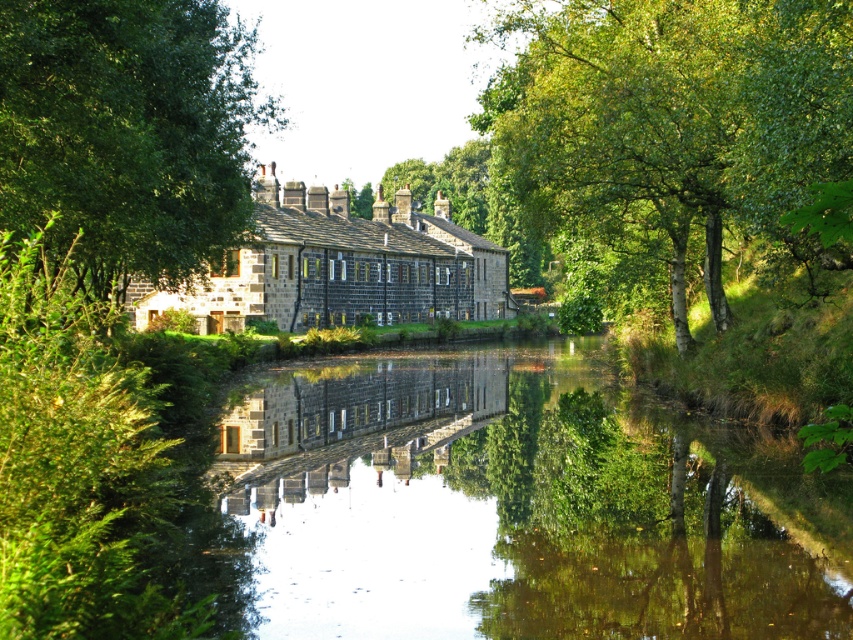
Question: Which point is farther from the camera taking this photo?

Choices:
 (A) (624, 19)
 (B) (189, 232)
 (C) (520, 634)

Answer: (A)

Question: Where is green leafy tree at upper center located in relation to green leafy tree at upper left in the image?

Choices:
 (A) left
 (B) right

Answer: (B)

Question: Can you confirm if smooth reflective water at center is positioned above green leafy tree at upper left?

Choices:
 (A) no
 (B) yes

Answer: (A)

Question: Is the position of smooth reflective water at center more distant than that of green leafy tree at upper left?

Choices:
 (A) yes
 (B) no

Answer: (B)

Question: Estimate the real-world distances between objects in this image. Which object is closer to the green leafy tree at upper left?

Choices:
 (A) smooth reflective water at center
 (B) green leafy tree at upper center

Answer: (A)

Question: Which point is farther to the camera?

Choices:
 (A) smooth reflective water at center
 (B) green leafy tree at upper center
 (C) green leafy tree at upper left

Answer: (C)